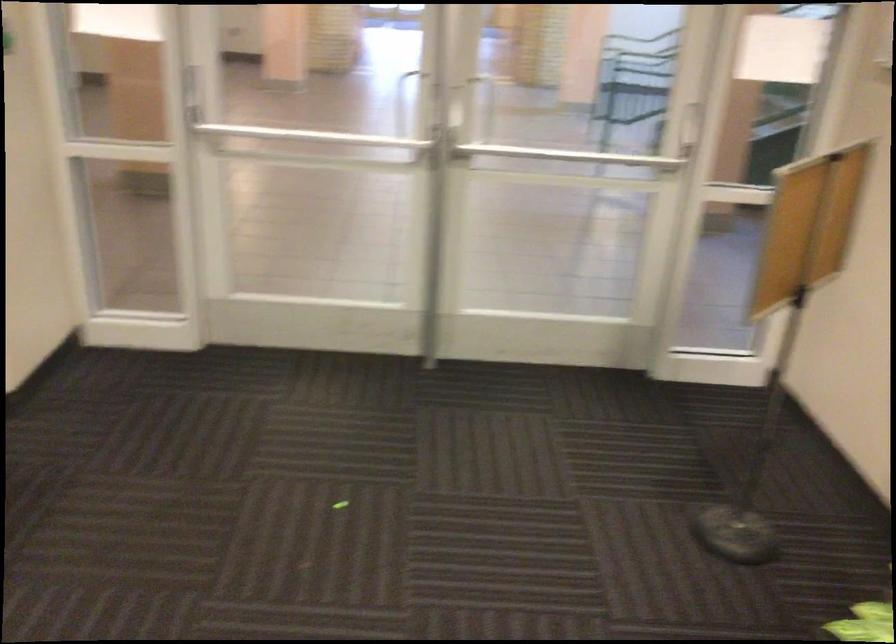
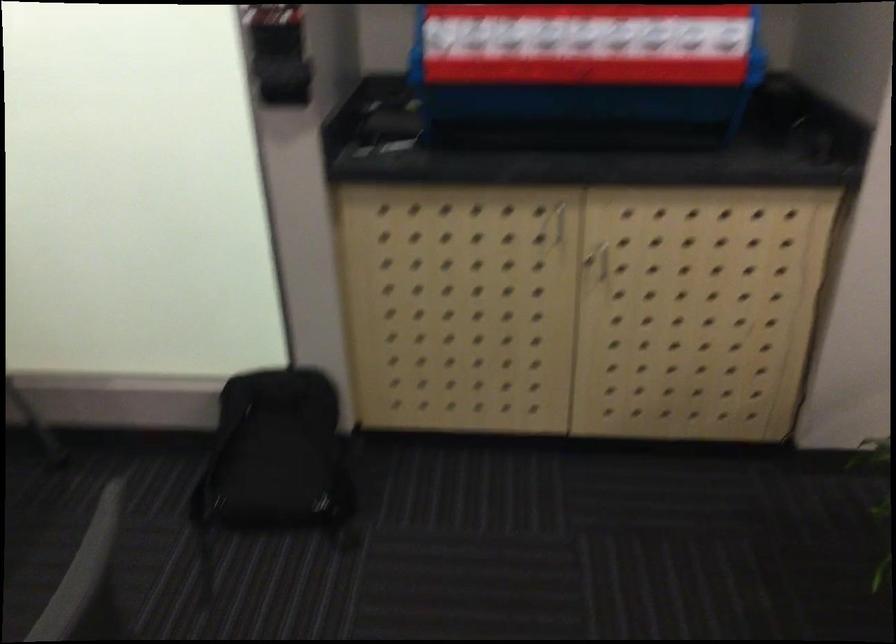
Question: What movement of the cameraman would produce the second image?

Choices:
 (A) Left
 (B) Right
 (C) Forward
 (D) Backward

Answer: (A)